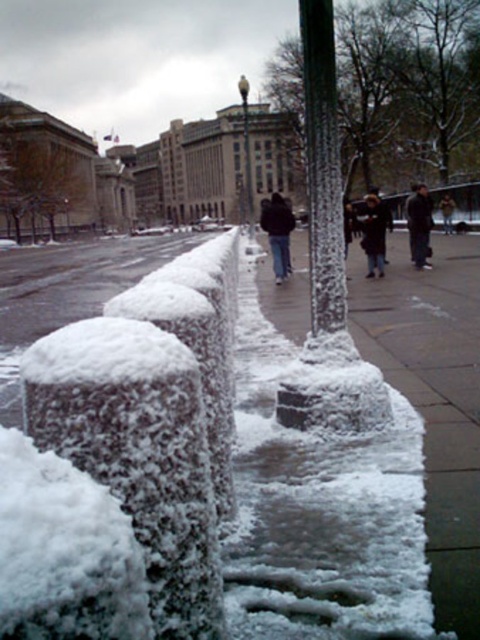
From the picture: You are standing on the snowy sidewalk and see two people wearing a dark blue jacket at center and a dark gray jacket at center. Which person is nearer to you?

Result: The dark blue jacket at center is closer to the viewer than the dark gray jacket at center, so the person wearing the dark blue jacket at center is nearer to you.